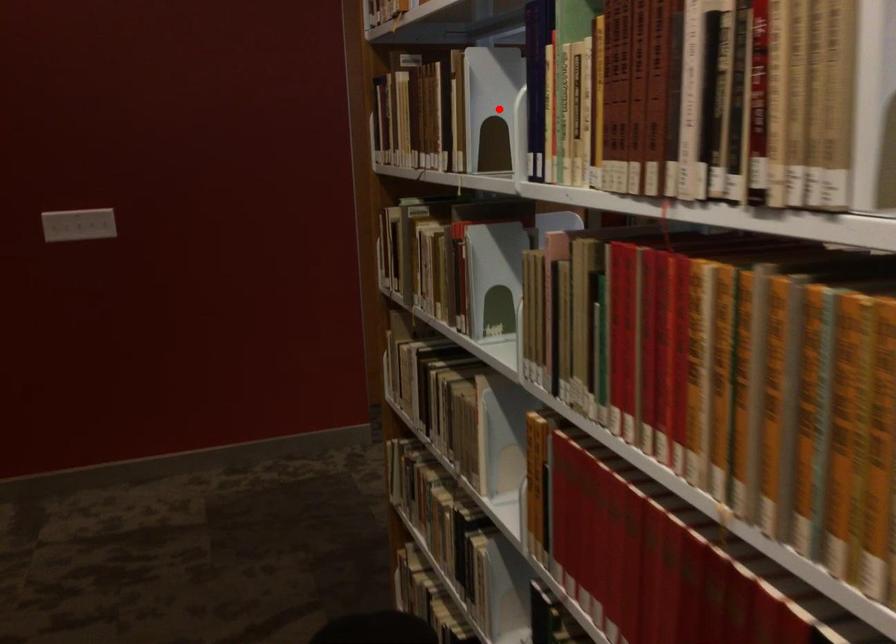
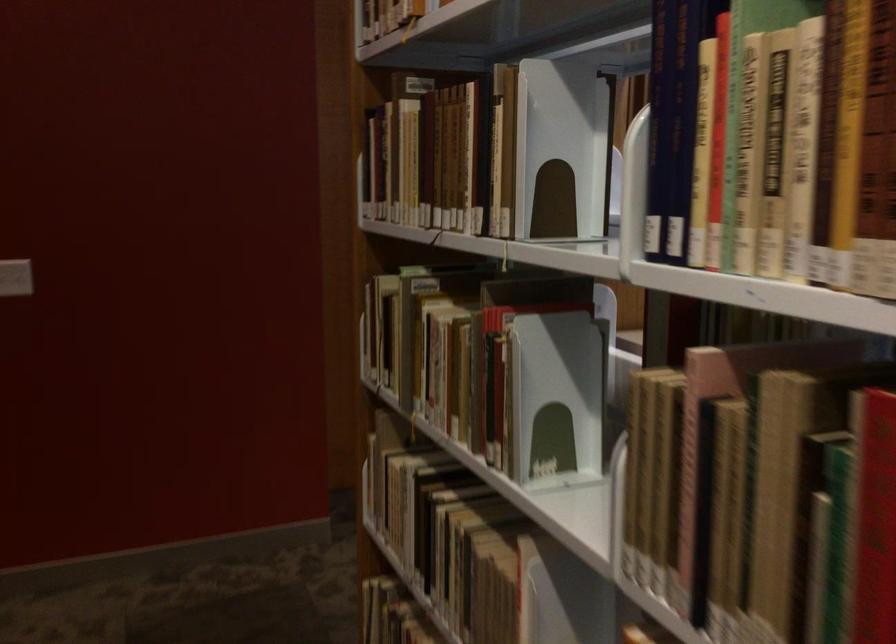
Question: A red point is marked in image1. In image2, is the corresponding 3D point closer to the camera or farther? Reply with the corresponding letter.

Choices:
 (A) The corresponding 3D point is closer.
 (B) The corresponding 3D point is farther.

Answer: (A)